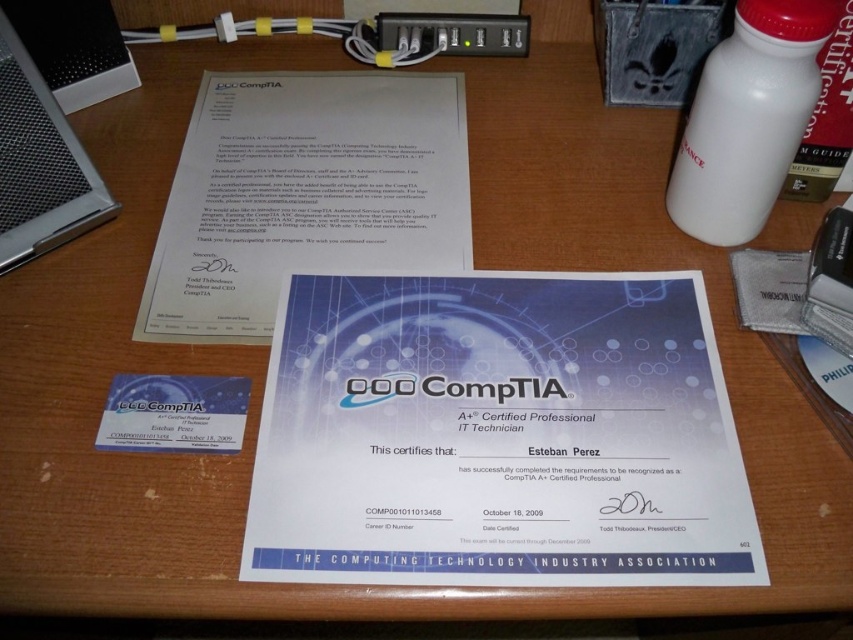
Does white paper certificate at center appear over white matte bottle at upper right?

Actually, white paper certificate at center is below white matte bottle at upper right.

This screenshot has width=853, height=640. I want to click on white paper certificate at center, so click(x=498, y=435).

Who is taller, white matte bottle at upper right or silver metallic computer at upper left?

With more height is white matte bottle at upper right.

Identify the location of white matte bottle at upper right. (747, 118).

Consider the image. Is white paper certificate at center taller than black plastic usb port at upper center?

Yes.

Is point (496, 440) less distant than point (519, 19)?

Yes.

The image size is (853, 640). Describe the element at coordinates (498, 435) in the screenshot. I see `white paper certificate at center` at that location.

Locate an element on the screen. white paper certificate at center is located at coordinates (498, 435).